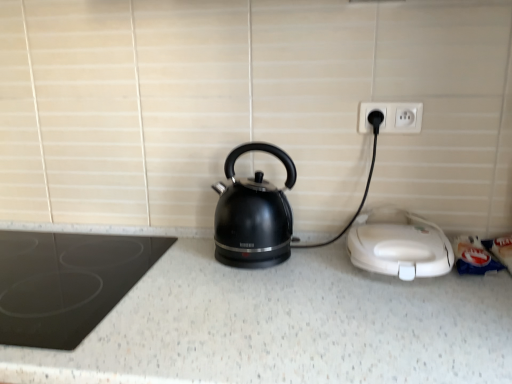
Locate an element on the screen. free space above white speckled granite at center (from a real-world perspective) is located at coordinates (231, 299).